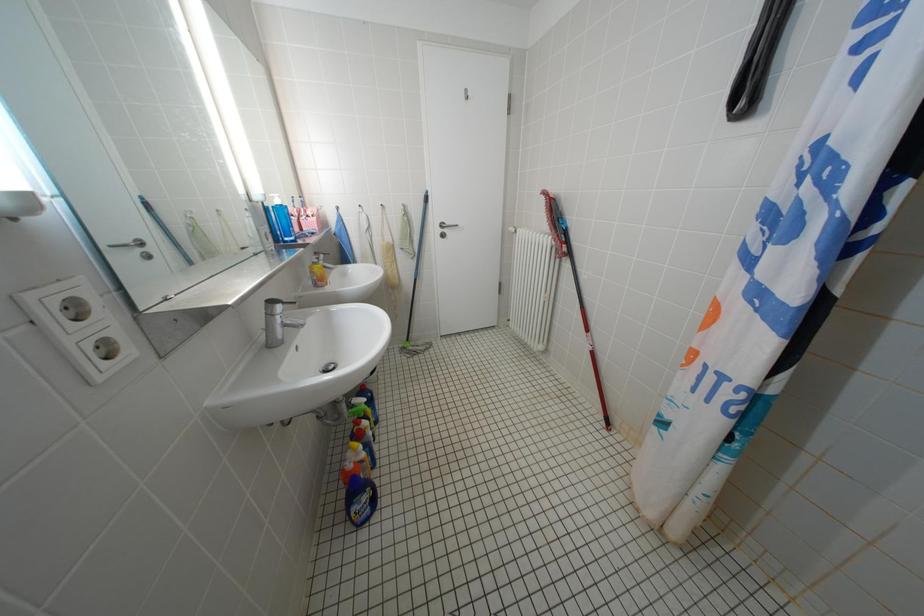
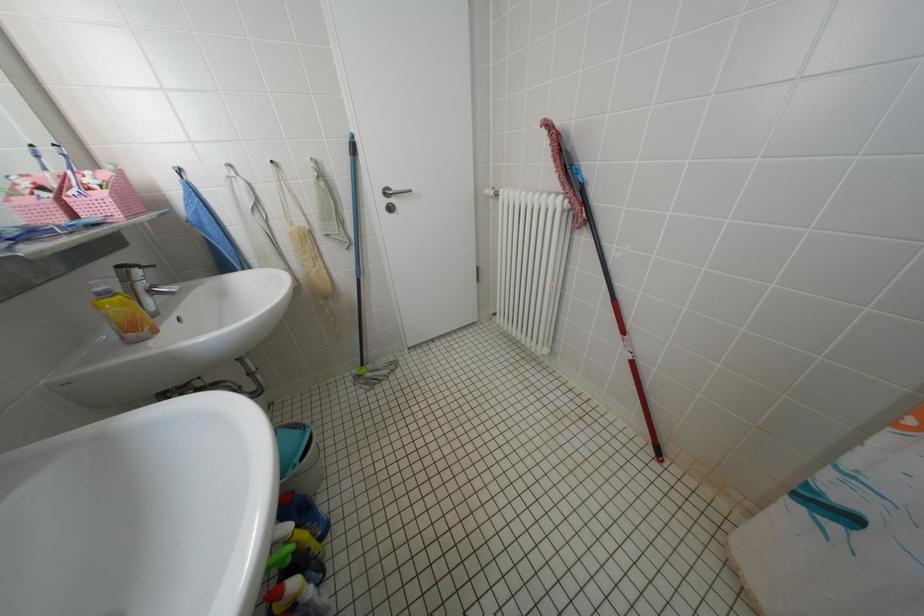
Question: The camera is either moving clockwise (left) or counter-clockwise (right) around the object. The first image is from the beginning of the video and the second image is from the end. Is the camera moving left or right when shooting the video?

Choices:
 (A) Left
 (B) Right

Answer: (A)